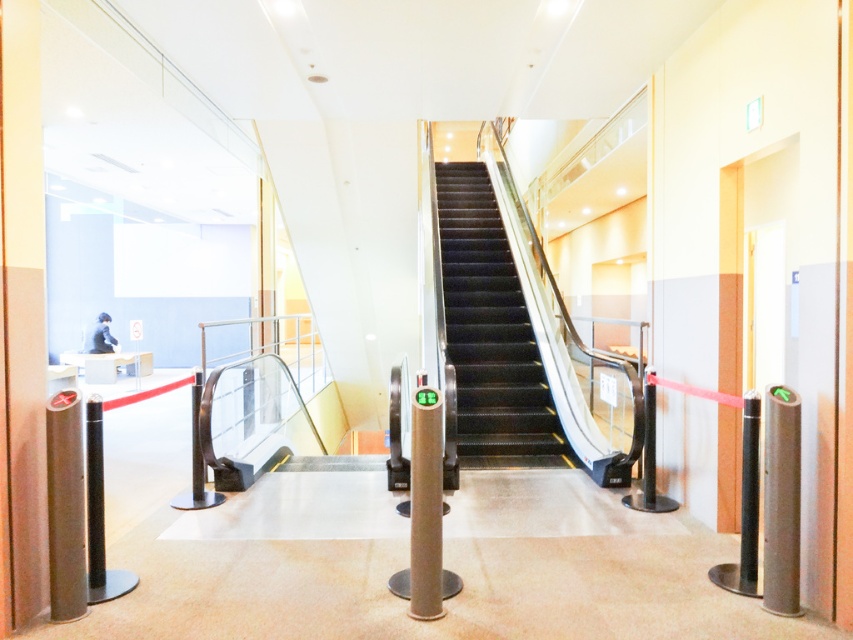
Question: Which object appears closest to the camera in this image?

Choices:
 (A) metallic gray post at left
 (B) black glossy escalator at center

Answer: (A)

Question: Can you confirm if black glossy escalator at center is wider than metallic gray post at center?

Choices:
 (A) no
 (B) yes

Answer: (B)

Question: Among these points, which one is farthest from the camera?

Choices:
 (A) (467, 304)
 (B) (53, 525)

Answer: (A)

Question: Based on their relative distances, which object is nearer to the metallic silver post at right?

Choices:
 (A) black glossy escalator at center
 (B) metallic gray post at left

Answer: (A)

Question: Is black glossy escalator at center smaller than metallic gray post at center?

Choices:
 (A) no
 (B) yes

Answer: (A)

Question: Where is metallic silver post at right located in relation to metallic gray post at center in the image?

Choices:
 (A) left
 (B) right

Answer: (B)